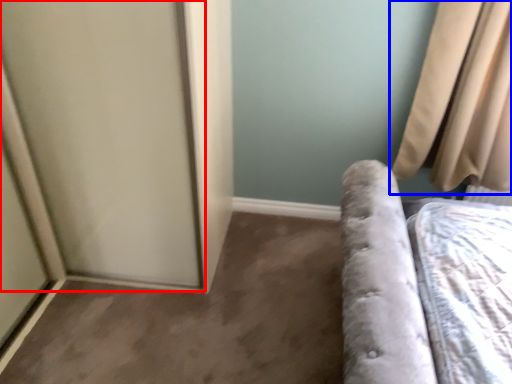
Question: Among these objects, which one is nearest to the camera, screen door (highlighted by a red box) or curtain (highlighted by a blue box)?

Choices:
 (A) screen door
 (B) curtain

Answer: (A)